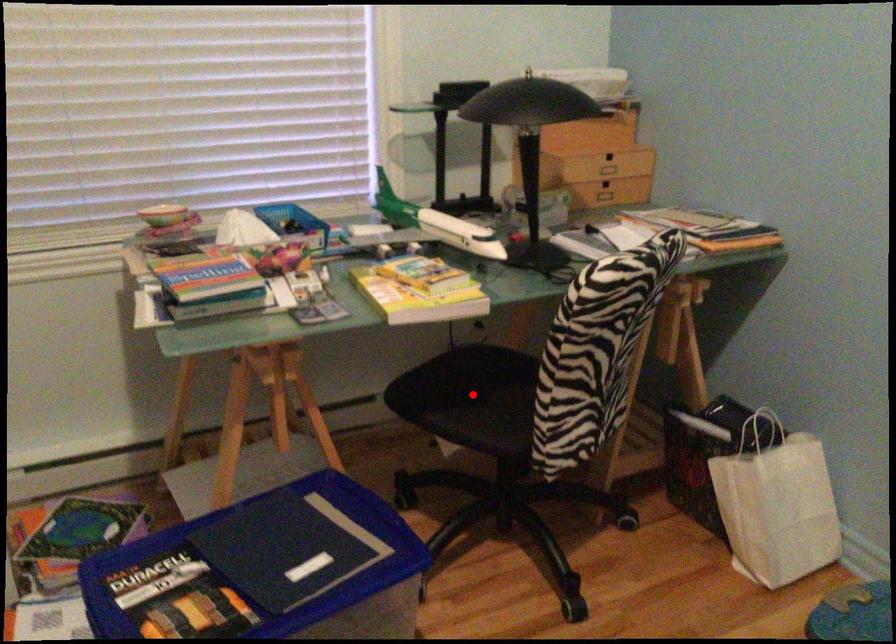
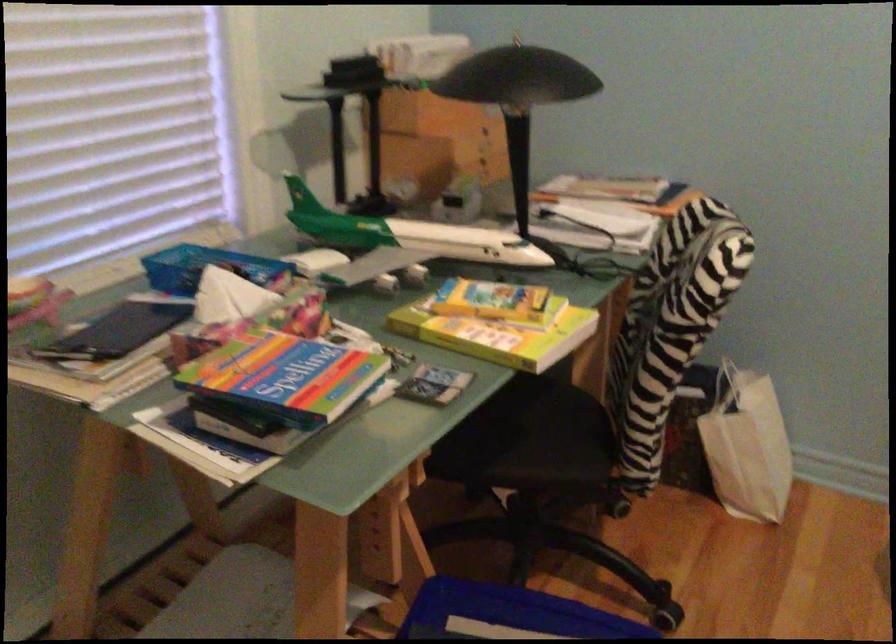
Question: I am providing you with two images of the same scene from different viewpoints. Image1 has a red point marked. In image2, the corresponding 3D location appears at what relative position? Reply with the corresponding letter.

Choices:
 (A) Closer
 (B) Farther

Answer: (A)